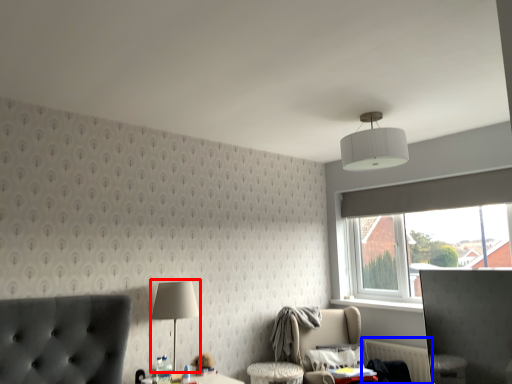
Question: Which object appears farthest to the camera in this image, table lamp (highlighted by a red box) or radiator (highlighted by a blue box)?

Choices:
 (A) table lamp
 (B) radiator

Answer: (B)